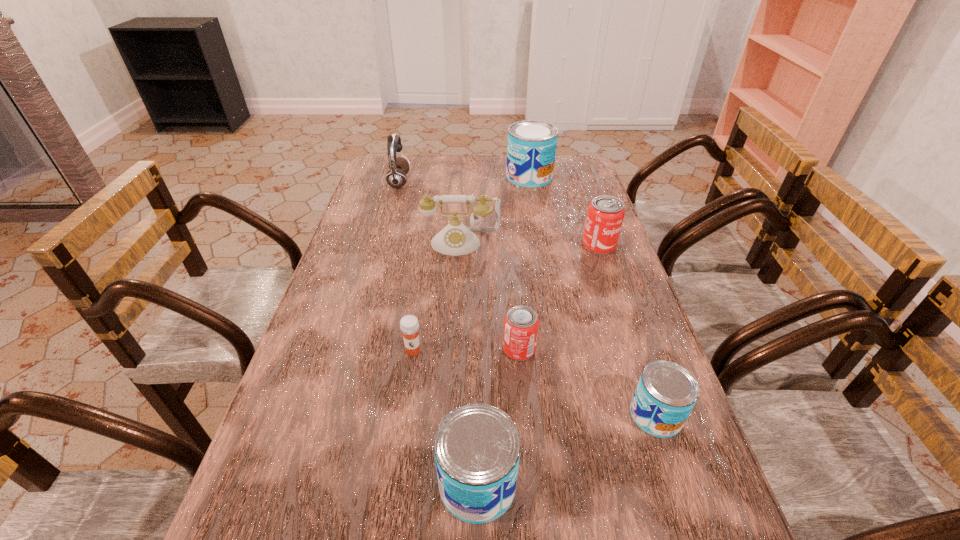
Locate which can ranks third in proximity to the fourth nearest can. Please provide its 2D coordinates. Your answer should be formatted as a tuple, i.e. [(x, y)], where the tuple contains the x and y coordinates of a point satisfying the conditions above.

[(666, 393)]

Locate which blue can ranks third in proximity to the white telephone. Please provide its 2D coordinates. Your answer should be formatted as a tuple, i.e. [(x, y)], where the tuple contains the x and y coordinates of a point satisfying the conditions above.

[(477, 447)]

Locate which blue can ranks second in proximity to the nearest blue can. Please provide its 2D coordinates. Your answer should be formatted as a tuple, i.e. [(x, y)], where the tuple contains the x and y coordinates of a point satisfying the conditions above.

[(531, 149)]

At what (x,y) coordinates should I click in order to perform the action: click on free spot that satisfies the following two spatial constraints: 1. on the dial of the white telephone; 2. on the left side of the rightmost blue can. Please return your answer as a coordinate pair (x, y). This screenshot has height=540, width=960. Looking at the image, I should click on (451, 415).

Locate an element on the screen. This screenshot has width=960, height=540. free space that satisfies the following two spatial constraints: 1. on the ear pads of the smaller red can; 2. on the right side of the earphone is located at coordinates (352, 349).

Image resolution: width=960 pixels, height=540 pixels. I want to click on free location that satisfies the following two spatial constraints: 1. on the ear pads of the second farthest blue can; 2. on the right side of the earphone, so click(334, 415).

Find the location of a particular element. Image resolution: width=960 pixels, height=540 pixels. free point that satisfies the following two spatial constraints: 1. on the label side of the nearest can; 2. on the right side of the medicine is located at coordinates (394, 483).